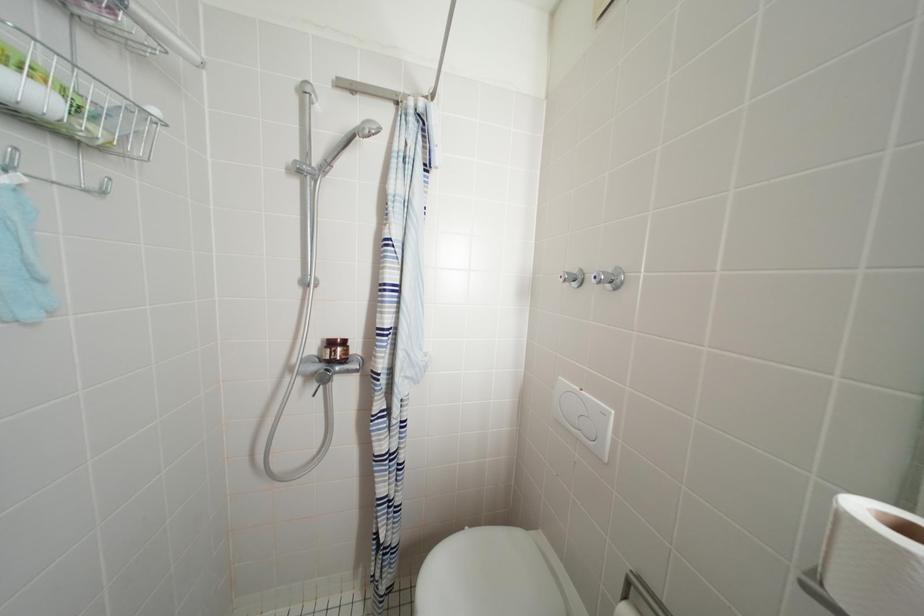
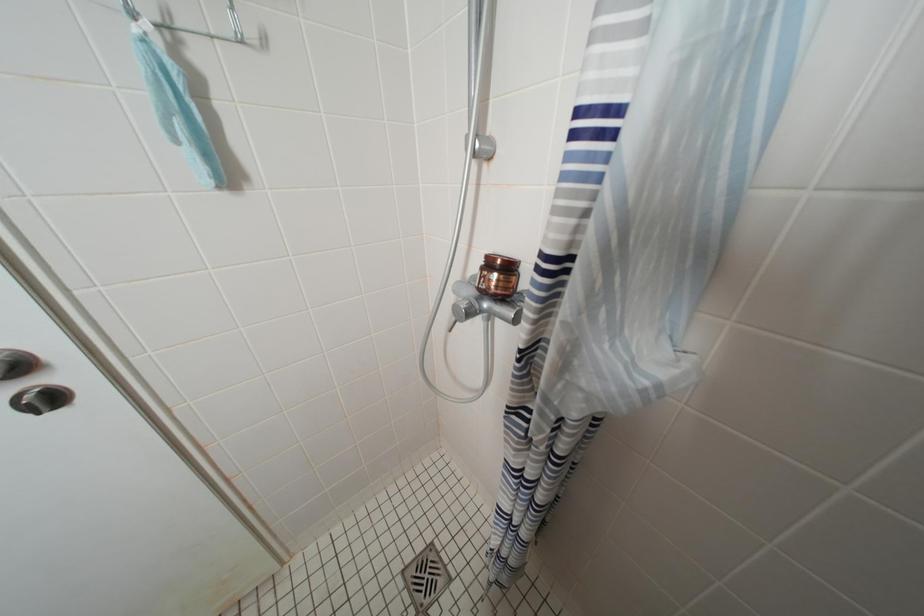
How did the camera likely rotate?

The camera rotated toward left-down.